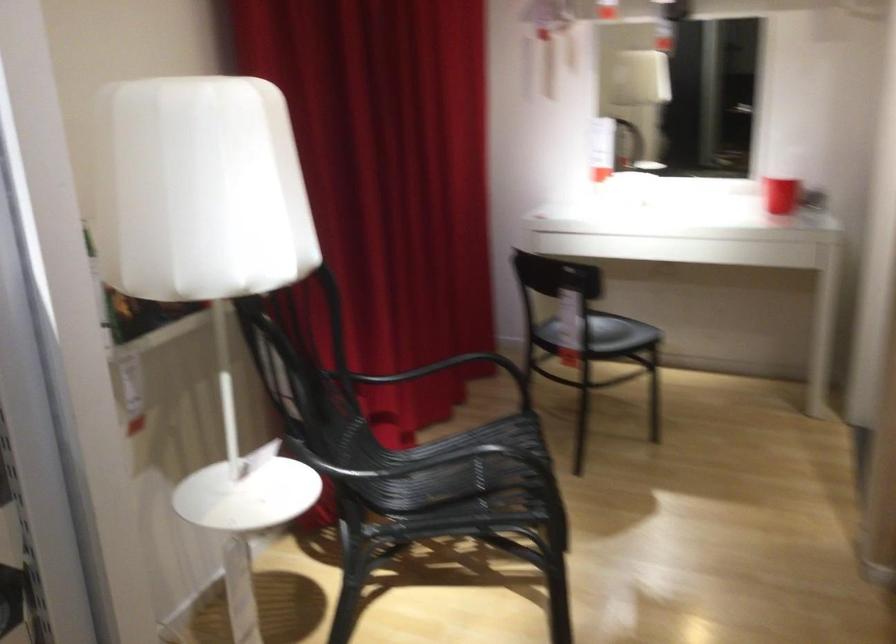
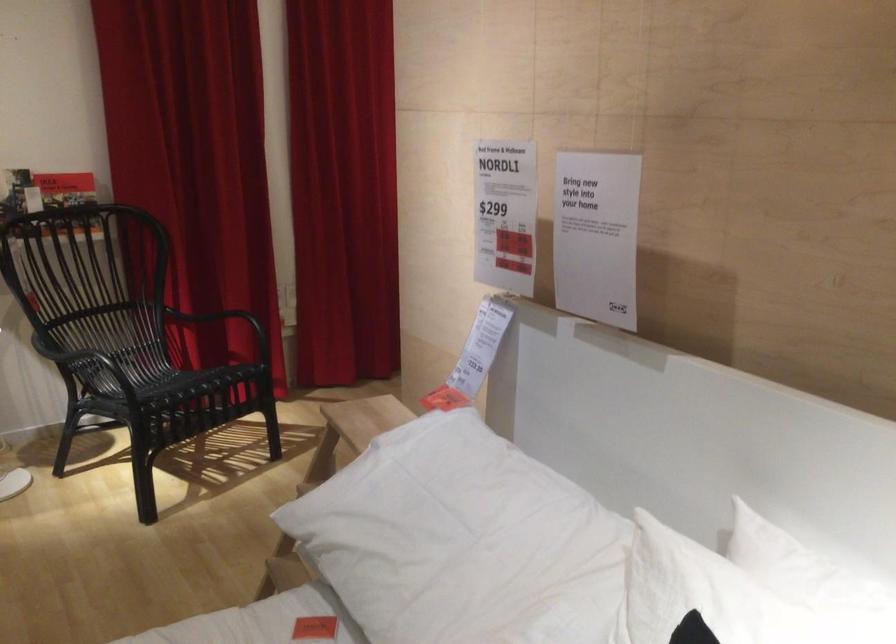
Question: In a continuous first-person perspective shot, in which direction is the camera moving?

Choices:
 (A) Left
 (B) Right
 (C) Forward
 (D) Backward

Answer: (B)